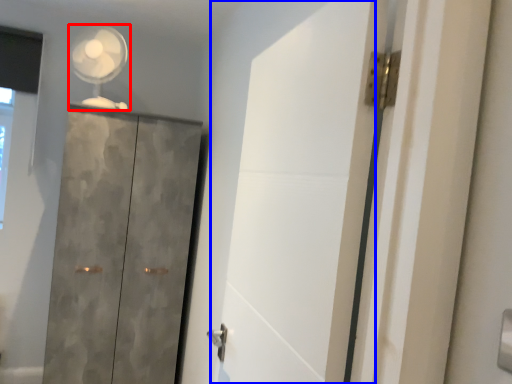
Question: Which of the following is the farthest to the observer, mechanical fan (highlighted by a red box) or screen door (highlighted by a blue box)?

Choices:
 (A) mechanical fan
 (B) screen door

Answer: (A)